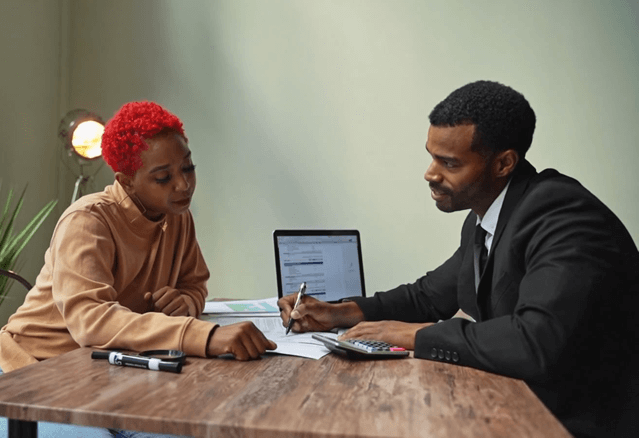
The width and height of the screenshot is (639, 438). What are the coordinates of `black marker` in the screenshot? It's located at (140, 347).